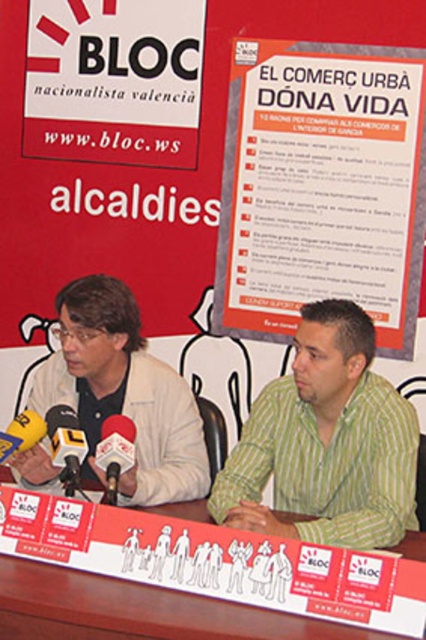
From the picture: You are attending a press conference and notice a green striped shirt at center and a metallic silver microphone at lower left. Which object is positioned higher in the image?

The green striped shirt at center is positioned higher than the metallic silver microphone at lower left.

You are standing in front of the promotional backdrop at the press conference. There are two points marked on the banner. Which point, point (351, 472) or point (78, 403), is closer to you?

Point (351, 472) is closer to the viewer than point (78, 403).

You are standing in front of the promotional backdrop at the press conference. There are two points marked on the banner. Which point, point 1 at coordinates (x=152, y=490) or point 2 at coordinates (x=114, y=499), is closer to you?

Point 1 at coordinates (x=152, y=490) is closer to you because it is further to the viewer than point 2 at coordinates (x=114, y=499).